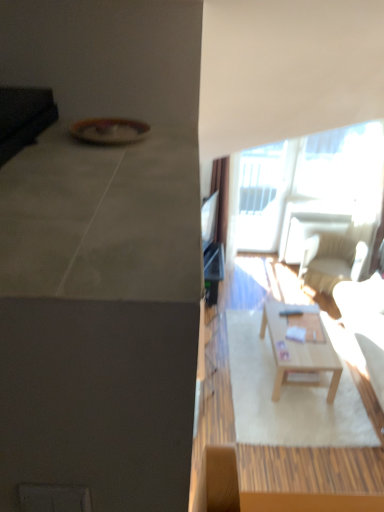
The width and height of the screenshot is (384, 512). Describe the element at coordinates (259, 177) in the screenshot. I see `transparent glass window at upper right` at that location.

Find the location of a particular element. white leather couch at right is located at coordinates (365, 323).

At what (x,y) coordinates should I click in order to perform the action: click on light beige fabric chair at right. Please return your answer as a coordinate pair (x, y). This screenshot has width=384, height=512. Looking at the image, I should click on (331, 260).

Considering the sizes of objects white leather couch at right and matte black tv at upper right in the image provided, who is wider, white leather couch at right or matte black tv at upper right?

With larger width is white leather couch at right.

Is white leather couch at right positioned far away from matte black tv at upper right?

Yes, white leather couch at right is far from matte black tv at upper right.

From a real-world perspective, between white leather couch at right and matte black tv at upper right, who is vertically higher?

matte black tv at upper right.

Is point (354, 290) positioned after point (212, 220)?

Yes.

Can you confirm if transparent glass window at upper right is wider than light brown wooden coffee table at center?

No.

How much distance is there between transparent glass window at upper right and light brown wooden coffee table at center?

transparent glass window at upper right and light brown wooden coffee table at center are 8.16 feet apart from each other.

From a real-world perspective, is transparent glass window at upper right physically below light brown wooden coffee table at center?

No, from a real-world perspective, transparent glass window at upper right is not below light brown wooden coffee table at center.

Is transparent glass window at upper right taller than light brown wooden coffee table at center?

Indeed, transparent glass window at upper right has a greater height compared to light brown wooden coffee table at center.

Is white leather couch at right bigger than light beige fabric chair at right?

Indeed, white leather couch at right has a larger size compared to light beige fabric chair at right.

This screenshot has width=384, height=512. I want to click on chair behind the white leather couch at right, so click(x=331, y=260).

From the picture: Is white leather couch at right far away from light beige fabric chair at right?

white leather couch at right is near light beige fabric chair at right, not far away.

From a real-world perspective, who is located higher, white leather couch at right or light beige fabric chair at right?

white leather couch at right, from a real-world perspective.

Do you think light brown wooden coffee table at center is within light beige fabric chair at right, or outside of it?

light brown wooden coffee table at center is outside light beige fabric chair at right.

Is light brown wooden coffee table at center further to camera compared to light beige fabric chair at right?

No, light brown wooden coffee table at center is closer to the viewer.

How different are the orientations of light brown wooden coffee table at center and light beige fabric chair at right in degrees?

The angle between the facing direction of light brown wooden coffee table at center and the facing direction of light beige fabric chair at right is 63.1 degrees.

From their relative heights in the image, would you say light brown wooden coffee table at center is taller or shorter than light beige fabric chair at right?

Considering their sizes, light brown wooden coffee table at center has less height than light beige fabric chair at right.

Does point (278, 331) come in front of point (209, 232)?

No.

Is light brown wooden coffee table at center taller or shorter than matte black tv at upper right?

light brown wooden coffee table at center is shorter than matte black tv at upper right.

You are a GUI agent. You are given a task and a screenshot of the screen. Output one action in this format:
    pyautogui.click(x=<x>, y=<y>)
    Task: Click on the television on the left side of light brown wooden coffee table at center
    This screenshot has height=512, width=384.
    Given the screenshot: What is the action you would take?
    pyautogui.click(x=209, y=220)

Between light brown wooden coffee table at center and matte black tv at upper right, which one has smaller size?

With smaller size is matte black tv at upper right.

Is light beige fabric chair at right not within light brown wooden coffee table at center?

Yes, light beige fabric chair at right is not within light brown wooden coffee table at center.

Considering the sizes of objects light beige fabric chair at right and light brown wooden coffee table at center in the image provided, who is thinner, light beige fabric chair at right or light brown wooden coffee table at center?

light brown wooden coffee table at center is thinner.

Considering the sizes of light beige fabric chair at right and light brown wooden coffee table at center in the image, is light beige fabric chair at right bigger or smaller than light brown wooden coffee table at center?

Considering their sizes, light beige fabric chair at right takes up more space than light brown wooden coffee table at center.

How different are the orientations of light beige fabric chair at right and light brown wooden coffee table at center in degrees?

63.1 degrees separate the facing orientations of light beige fabric chair at right and light brown wooden coffee table at center.

Could transparent glass window at upper right be considered to be inside light beige fabric chair at right?

No, transparent glass window at upper right is located outside of light beige fabric chair at right.

Which is closer, (358, 245) or (263, 187)?

Point (358, 245) appears to be closer to the viewer than point (263, 187).

From the image's perspective, relative to transparent glass window at upper right, is light beige fabric chair at right above or below?

Clearly, from the image's perspective, light beige fabric chair at right is below transparent glass window at upper right.

From a real-world perspective, is light beige fabric chair at right physically below transparent glass window at upper right?

Yes.

Identify the location of television on the left of white leather couch at right. (209, 220).

There is a light brown wooden coffee table at center. Identify the location of window above it (from a real-world perspective). (259, 177).

From the image, which object appears to be farther from light beige fabric chair at right, white leather couch at right or matte black tv at upper right?

matte black tv at upper right lies further to light beige fabric chair at right than the other object.

When comparing their distances from matte black tv at upper right, does light brown wooden coffee table at center or light beige fabric chair at right seem further?

The object further to matte black tv at upper right is light beige fabric chair at right.

Looking at the image, which one is located closer to transparent glass window at upper right, light beige fabric chair at right or white leather couch at right?

Among the two, light beige fabric chair at right is located nearer to transparent glass window at upper right.

Which object lies further to the anchor point light beige fabric chair at right, matte black tv at upper right or white leather couch at right?

Among the two, matte black tv at upper right is located further to light beige fabric chair at right.

Estimate the real-world distances between objects in this image. Which object is closer to light beige fabric chair at right, white leather couch at right or transparent glass window at upper right?

white leather couch at right is positioned closer to the anchor light beige fabric chair at right.

Which object lies nearer to the anchor point white leather couch at right, matte black tv at upper right or light brown wooden coffee table at center?

light brown wooden coffee table at center lies closer to white leather couch at right than the other object.

Estimate the real-world distances between objects in this image. Which object is closer to white leather couch at right, transparent glass window at upper right or light beige fabric chair at right?

light beige fabric chair at right is positioned closer to the anchor white leather couch at right.

Based on their spatial positions, is matte black tv at upper right or white leather couch at right closer to transparent glass window at upper right?

Among the two, white leather couch at right is located nearer to transparent glass window at upper right.

The image size is (384, 512). What are the coordinates of `window between matte black tv at upper right and light beige fabric chair at right in the horizontal direction` in the screenshot? It's located at (259, 177).

In order to click on coffee table between white leather couch at right and light beige fabric chair at right from front to back in this screenshot , I will do `click(298, 351)`.

The width and height of the screenshot is (384, 512). In order to click on television between transparent glass window at upper right and light brown wooden coffee table at center in the vertical direction in this screenshot , I will do `click(209, 220)`.

At what (x,y) coordinates should I click in order to perform the action: click on coffee table between matte black tv at upper right and white leather couch at right. Please return your answer as a coordinate pair (x, y). The width and height of the screenshot is (384, 512). Looking at the image, I should click on [298, 351].